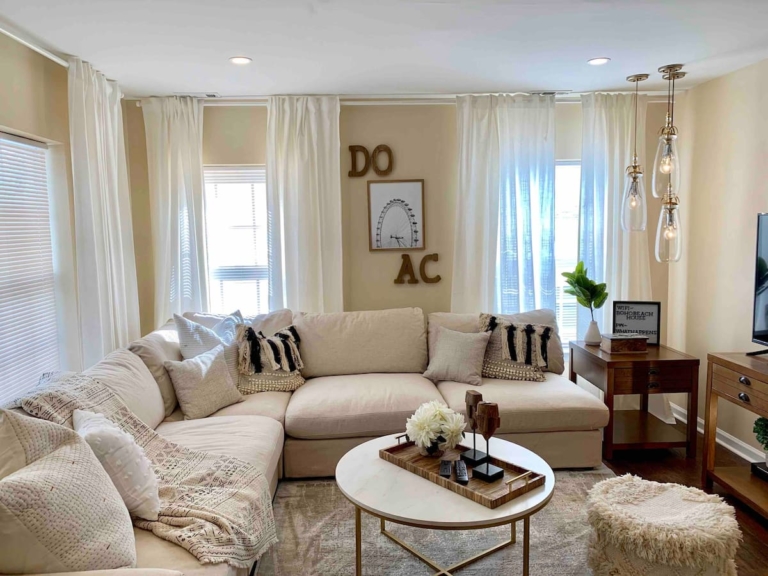
Locate an element on the screen. This screenshot has height=576, width=768. wall art is located at coordinates (395, 216).